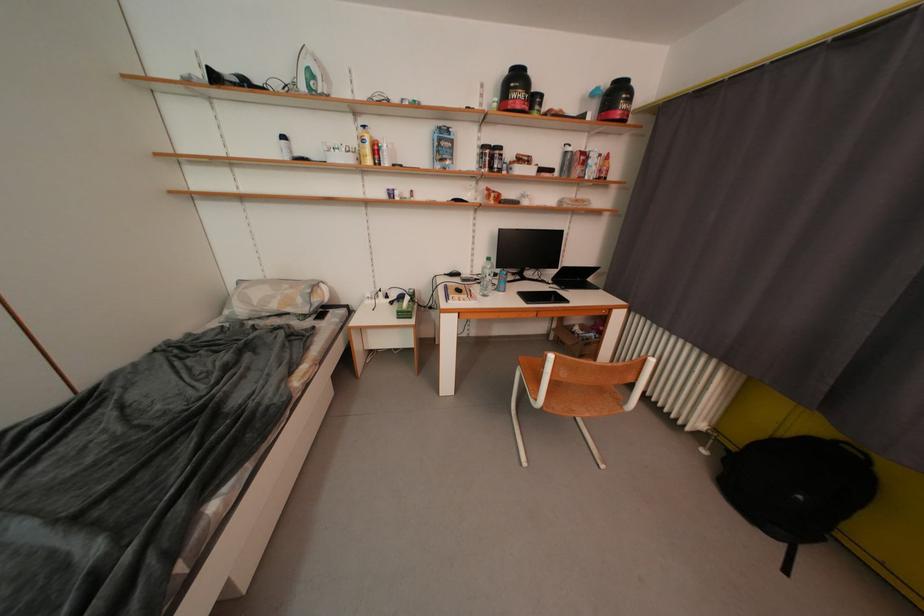
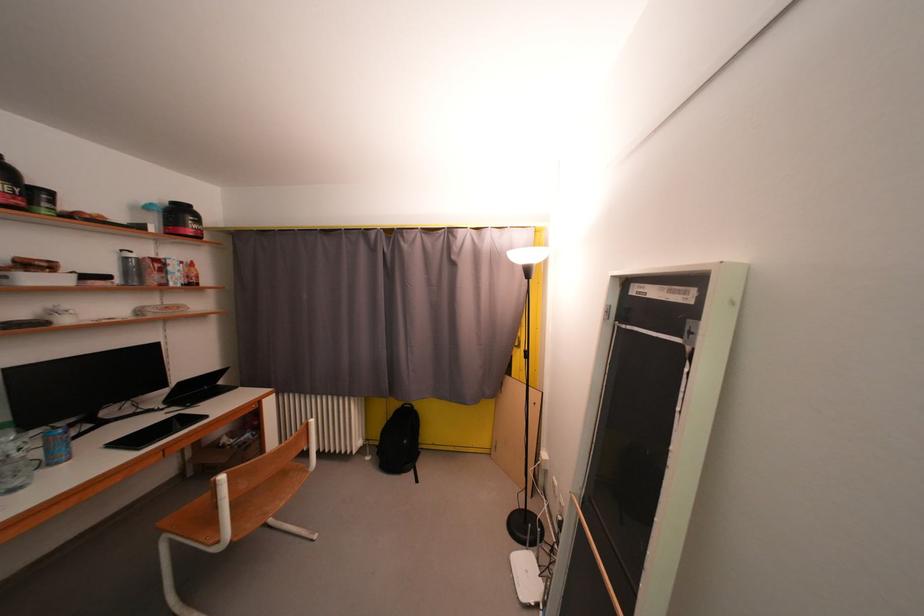
Question: I am providing you with two images of the same scene from different viewpoints. After the viewpoint changes to image2, which objects are now occluded?

Choices:
 (A) chair sitting surface
 (B) silver water bottle
 (C) black laptop
 (D) none of these

Answer: (D)